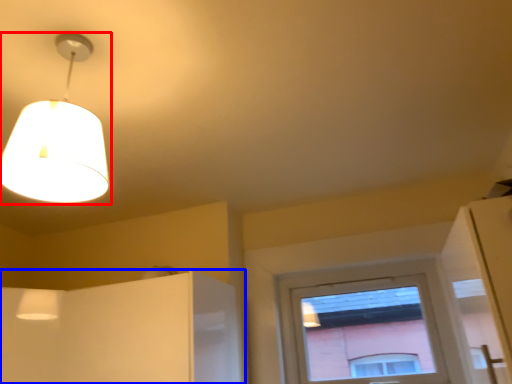
Question: Which object is further to the camera taking this photo, lamp (highlighted by a red box) or cabinetry (highlighted by a blue box)?

Choices:
 (A) lamp
 (B) cabinetry

Answer: (B)